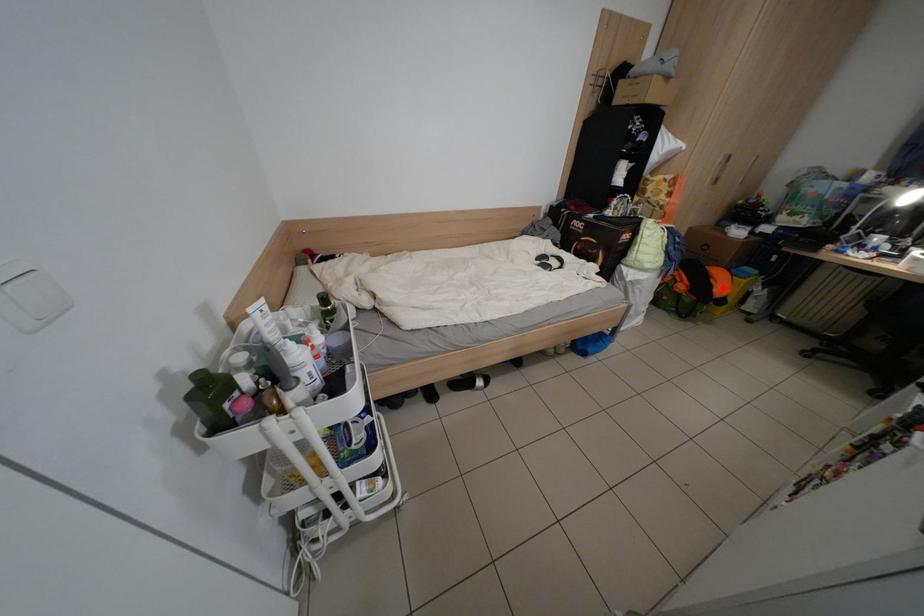
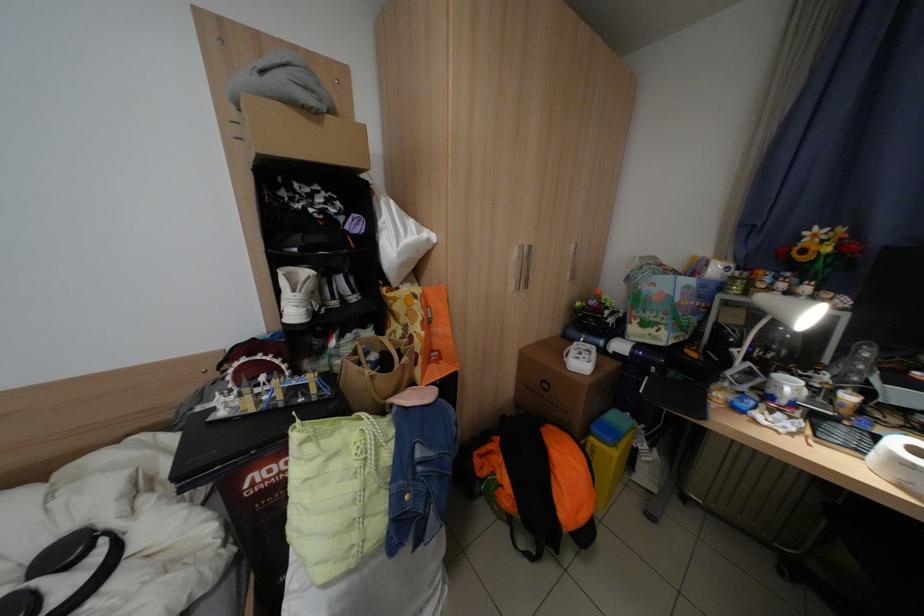
Locate, in the second image, the point that corresponds to the highlighted location in the first image.

(565, 508)